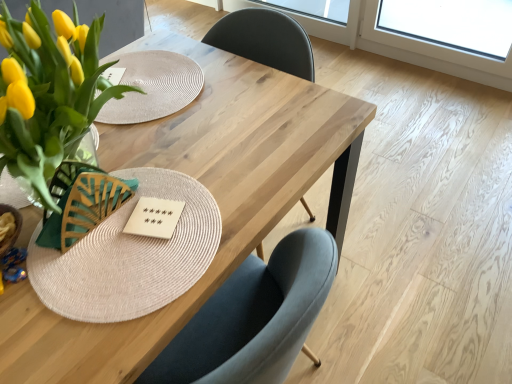
What are the coordinates of `free space in front of wooden card game at center` in the screenshot? It's located at (131, 291).